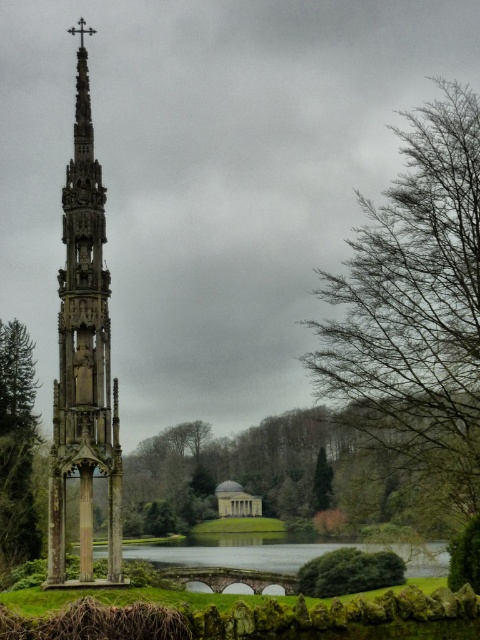
You are standing in the landscape and notice the bare branches at right and the green coniferous tree at center. Which of these two objects is positioned higher in the scene?

The bare branches at right is located above the green coniferous tree at center, so it is positioned higher in the scene.

You are standing at the base of the Gothic monument and want to walk towards the small classical building on the island. There are two points marked on the path leading from the monument to the island. The first point is at coordinates point (396, 356) and the second is at point (321, 460). Which point should you reach first while walking towards the classical building?

Point (396, 356) is closer to the viewer than point (321, 460), so you will reach point (396, 356) first while walking towards the classical building.